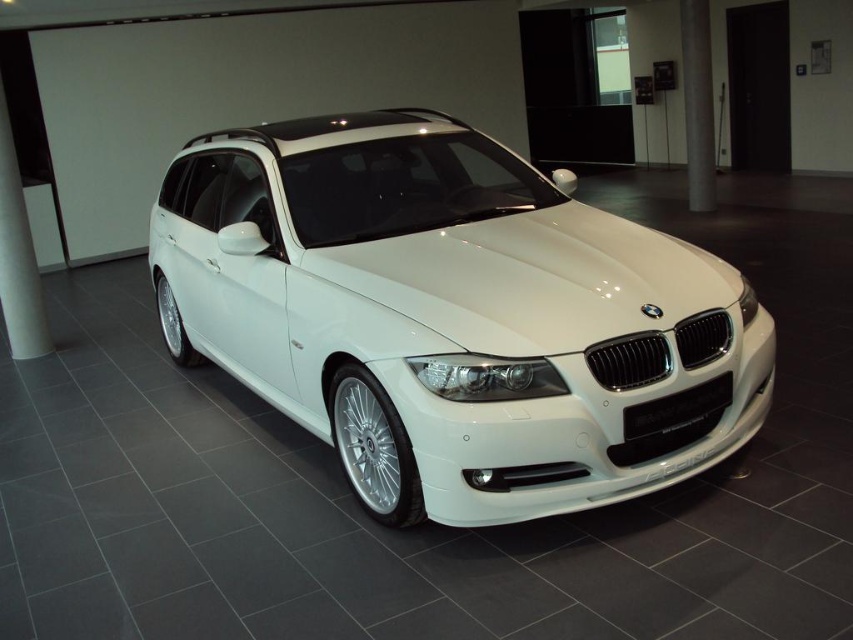
You are standing in a showroom and want to take a photo of the white metallic car at center. The camera you are using has a focal length of 50mm. If you want to ensure the entire car is in the frame, which of the following distances should you maintain from the point represented by point (454, 316)? Assume the camera sensor size is 24mm x 36mm and the car is 4.8 meters long.

The point (454, 316) represents the white metallic car at center. To capture the entire car in the frame, you need to be at least 4.8 meters away from the point (454, 316).

You are standing in front of the white BMW station wagon in the showroom. There are two points marked on the car, one at coordinates point (424,157) and the other at point (9,200). Which of these points is nearer to you?

Point (424,157) is closer to the viewer than point (9,200).